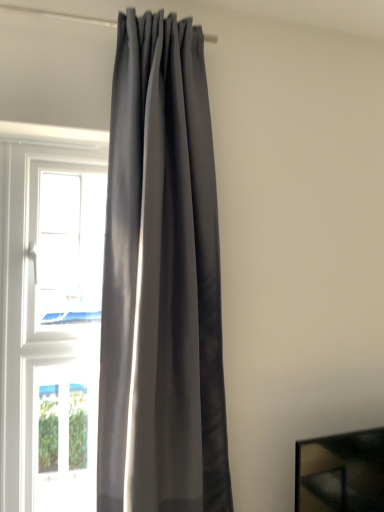
Question: Is matte gray curtain at center behind white glossy window at left, which ranks as the first window in top-to-bottom order?

Choices:
 (A) no
 (B) yes

Answer: (A)

Question: Is white glossy window at left, the second window ordered from the bottom, at the back of matte gray curtain at center?

Choices:
 (A) yes
 (B) no

Answer: (B)

Question: Considering the relative sizes of matte gray curtain at center and white glossy window at left, the second window ordered from the bottom, in the image provided, is matte gray curtain at center smaller than white glossy window at left, the second window ordered from the bottom,?

Choices:
 (A) no
 (B) yes

Answer: (A)

Question: Can you confirm if matte gray curtain at center is taller than white glossy window at left, which ranks as the first window in top-to-bottom order?

Choices:
 (A) yes
 (B) no

Answer: (A)

Question: Is matte gray curtain at center aimed at white glossy window at left, the second window ordered from the bottom?

Choices:
 (A) yes
 (B) no

Answer: (B)

Question: Is matte gray curtain at center positioned far away from white glossy window at left, the second window ordered from the bottom?

Choices:
 (A) no
 (B) yes

Answer: (A)

Question: Is transparent glass window at left, marked as the 1th window in a bottom-to-top arrangement, oriented towards matte gray curtain at center?

Choices:
 (A) yes
 (B) no

Answer: (B)

Question: Are transparent glass window at left, marked as the 1th window in a bottom-to-top arrangement, and matte gray curtain at center located far from each other?

Choices:
 (A) yes
 (B) no

Answer: (B)

Question: Is transparent glass window at left, arranged as the 2th window when viewed from the top, further to the viewer compared to matte gray curtain at center?

Choices:
 (A) yes
 (B) no

Answer: (A)

Question: Would you say transparent glass window at left, marked as the 1th window in a bottom-to-top arrangement, is outside matte gray curtain at center?

Choices:
 (A) no
 (B) yes

Answer: (B)

Question: Considering the relative sizes of transparent glass window at left, marked as the 1th window in a bottom-to-top arrangement, and matte gray curtain at center in the image provided, is transparent glass window at left, marked as the 1th window in a bottom-to-top arrangement, taller than matte gray curtain at center?

Choices:
 (A) yes
 (B) no

Answer: (B)

Question: Is matte gray curtain at center inside transparent glass window at left, marked as the 1th window in a bottom-to-top arrangement?

Choices:
 (A) no
 (B) yes

Answer: (A)

Question: Could you tell me if white glossy window at left, which ranks as the first window in top-to-bottom order, is turned towards transparent glass window at left, arranged as the 2th window when viewed from the top?

Choices:
 (A) no
 (B) yes

Answer: (A)